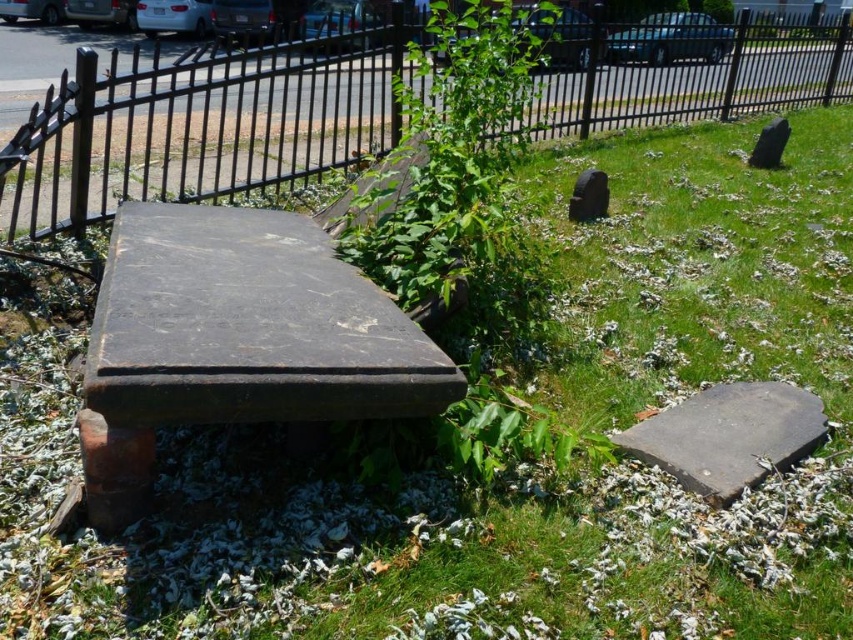
This screenshot has height=640, width=853. What do you see at coordinates (457, 173) in the screenshot?
I see `green leafy plant at center` at bounding box center [457, 173].

Is green leafy plant at center taller than gray stone slab at lower right?

Yes.

Who is more distant from viewer, (524, 97) or (631, 429)?

Positioned behind is point (524, 97).

Locate an element on the screen. This screenshot has height=640, width=853. green leafy plant at center is located at coordinates click(x=457, y=173).

Who is more forward, (247, 417) or (775, 147)?

Positioned in front is point (247, 417).

Does dark gray stone bench at center appear on the right side of black stone gravestone at upper right?

No, dark gray stone bench at center is not to the right of black stone gravestone at upper right.

The height and width of the screenshot is (640, 853). What are the coordinates of `dark gray stone bench at center` in the screenshot? It's located at pos(236,340).

Which of these two, black metal fence at upper center or gray stone slab at lower right, stands shorter?

gray stone slab at lower right

Is black metal fence at upper center above gray stone slab at lower right?

Yes.

Identify the location of black metal fence at upper center. Image resolution: width=853 pixels, height=640 pixels. (194, 128).

Image resolution: width=853 pixels, height=640 pixels. In order to click on black metal fence at upper center in this screenshot , I will do `click(194, 128)`.